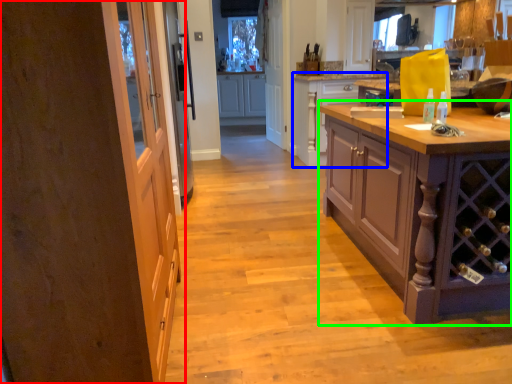
Question: Considering the real-world distances, which object is farthest from door (highlighted by a red box)? cabinetry (highlighted by a blue box) or cabinetry (highlighted by a green box)?

Choices:
 (A) cabinetry
 (B) cabinetry

Answer: (A)